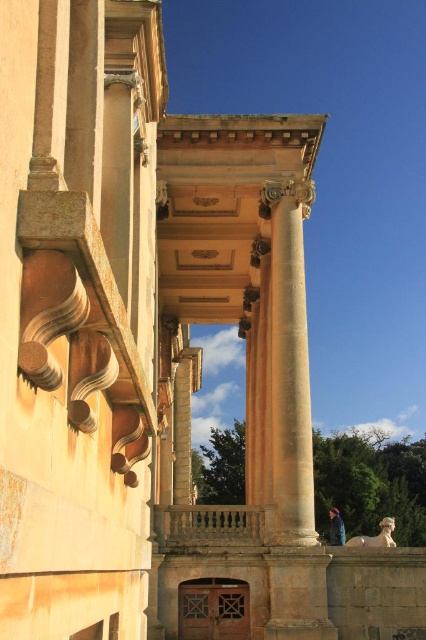
Question: Can you confirm if beige stone column at center is bigger than blue denim jacket at lower right?

Choices:
 (A) yes
 (B) no

Answer: (A)

Question: Among these points, which one is nearest to the camera?

Choices:
 (A) (333, 524)
 (B) (310, 182)

Answer: (B)

Question: Is beige stone column at center in front of blue denim jacket at lower right?

Choices:
 (A) no
 (B) yes

Answer: (B)

Question: From the image, what is the correct spatial relationship of beige stone column at center in relation to blue denim jacket at lower right?

Choices:
 (A) left
 (B) right

Answer: (A)

Question: Which point is closer to the camera?

Choices:
 (A) blue denim jacket at lower right
 (B) beige stone column at center

Answer: (B)